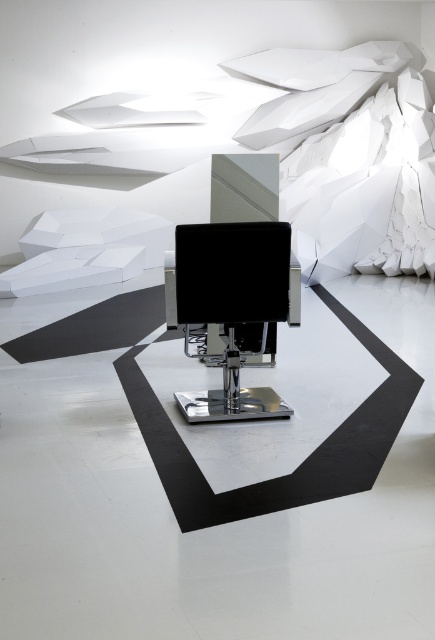
Can you confirm if black leather sewing machine at center is smaller than black glossy monitor at center?

No.

Is point (236, 246) farther from camera compared to point (216, 301)?

That is False.

Between point (220, 282) and point (241, 272), which one is positioned in front?

Point (241, 272) is more forward.

At what (x,y) coordinates should I click in order to perform the action: click on black leather sewing machine at center. Please return your answer as a coordinate pair (x, y). The height and width of the screenshot is (640, 435). Looking at the image, I should click on (233, 305).